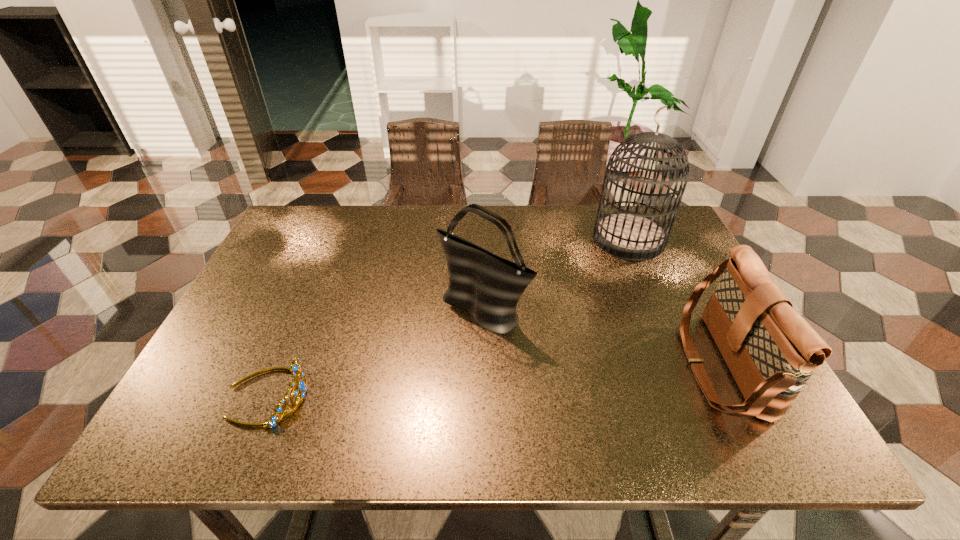
Image resolution: width=960 pixels, height=540 pixels. I want to click on birdcage, so click(628, 235).

Image resolution: width=960 pixels, height=540 pixels. I want to click on the farthest object, so click(628, 235).

I want to click on the left shoulder bag, so click(x=489, y=286).

Image resolution: width=960 pixels, height=540 pixels. What are the coordinates of `the taller shoulder bag` in the screenshot? It's located at (489, 286).

You are a GUI agent. You are given a task and a screenshot of the screen. Output one action in this format:
    pyautogui.click(x=<x>, y=<y>)
    Task: Click on the third tallest object
    The width and height of the screenshot is (960, 540).
    Given the screenshot: What is the action you would take?
    pyautogui.click(x=771, y=351)

The image size is (960, 540). In order to click on the right shoulder bag in this screenshot , I will do `click(771, 351)`.

Identify the location of the leftmost object. This screenshot has height=540, width=960. pyautogui.click(x=296, y=369).

Where is `tiara`? The width and height of the screenshot is (960, 540). tiara is located at coordinates (296, 369).

Find the location of a particular element. The image size is (960, 540). vacant space located on the front of the birdcage is located at coordinates point(687,374).

Where is `free space located 0.130m on the left of the left shoulder bag`? free space located 0.130m on the left of the left shoulder bag is located at coordinates (x=386, y=309).